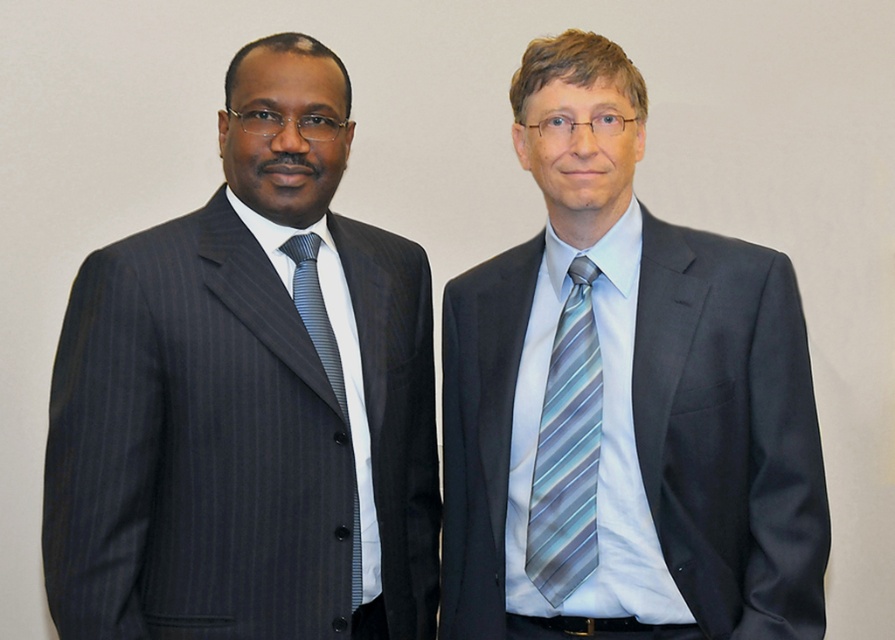
Between pinstriped suit at left and matte gray suit at center, which one has less height?

Standing shorter between the two is pinstriped suit at left.

Which is above, pinstriped suit at left or matte gray suit at center?

pinstriped suit at left is higher up.

Describe the element at coordinates (249, 397) in the screenshot. The height and width of the screenshot is (640, 895). I see `pinstriped suit at left` at that location.

Find the location of a particular element. Image resolution: width=895 pixels, height=640 pixels. pinstriped suit at left is located at coordinates (249, 397).

Is point (552, 500) behind point (557, 394)?

That is False.

Who is lower down, matte gray suit at center or blue striped tie at center?

blue striped tie at center

In order to click on matte gray suit at center in this screenshot , I will do `click(623, 401)`.

Who is positioned more to the right, blue striped tie at center or striped silk tie at left?

Positioned to the right is blue striped tie at center.

What do you see at coordinates (567, 449) in the screenshot?
I see `blue striped tie at center` at bounding box center [567, 449].

The image size is (895, 640). Find the location of `blue striped tie at center`. blue striped tie at center is located at coordinates (567, 449).